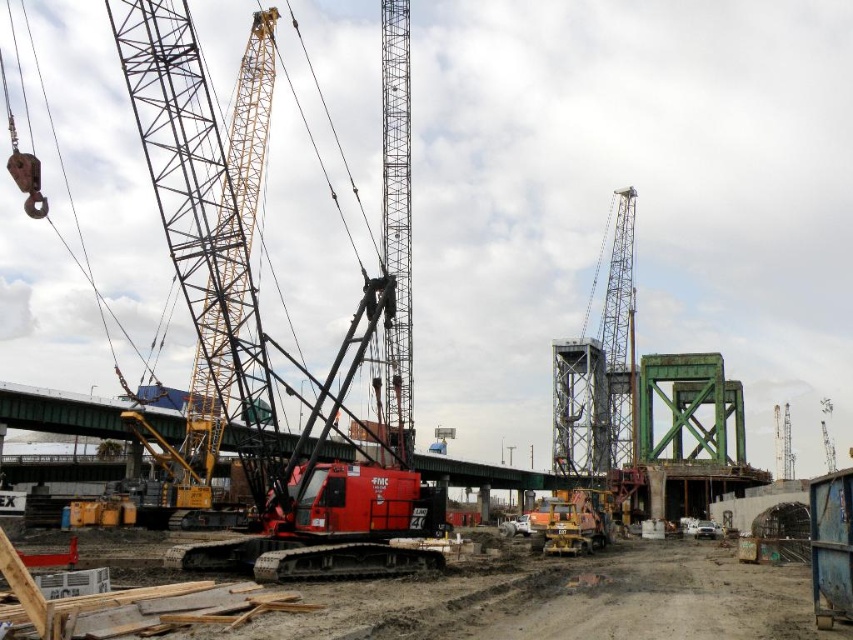
Is yellow metallic crane at left above metallic gray crane at center?

Yes, yellow metallic crane at left is above metallic gray crane at center.

Does yellow metallic crane at left appear on the right side of metallic gray crane at center?

In fact, yellow metallic crane at left is to the left of metallic gray crane at center.

What are the coordinates of `yellow metallic crane at left` in the screenshot? It's located at (207, 220).